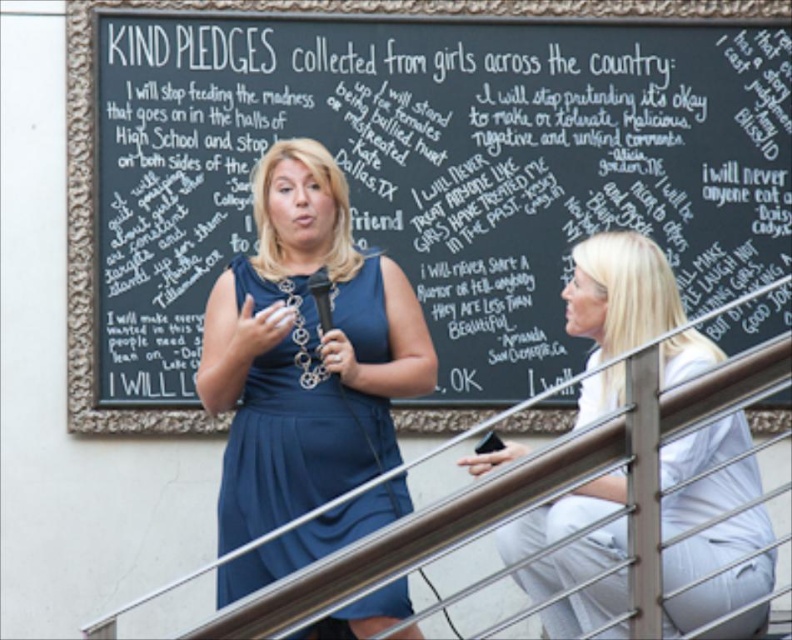
Which of these two, white fabric blouse at right or metallic silver railing at center, stands shorter?

With less height is metallic silver railing at center.

Which is more to the left, white fabric blouse at right or metallic silver railing at center?

From the viewer's perspective, metallic silver railing at center appears more on the left side.

Where is `white fabric blouse at right`? The height and width of the screenshot is (640, 792). white fabric blouse at right is located at coordinates (619, 292).

Locate an element on the screen. white fabric blouse at right is located at coordinates (619, 292).

Is black chalkboard at upper center positioned at the back of metallic silver railing at center?

Yes.

In the scene shown: Measure the distance between black chalkboard at upper center and camera.

They are 59.13 meters apart.

Which is behind, point (65, 113) or point (372, 481)?

Positioned behind is point (65, 113).

Where is `black chalkboard at upper center`? This screenshot has width=792, height=640. black chalkboard at upper center is located at coordinates (261, 12).

Who is lower down, white fabric blouse at right or matte blue dress at center?

Positioned lower is matte blue dress at center.

Which is behind, point (589, 316) or point (326, 429)?

The point (589, 316) is behind.

Find the location of a particular element. The width and height of the screenshot is (792, 640). white fabric blouse at right is located at coordinates (619, 292).

Where is `white fabric blouse at right`? The width and height of the screenshot is (792, 640). white fabric blouse at right is located at coordinates (619, 292).